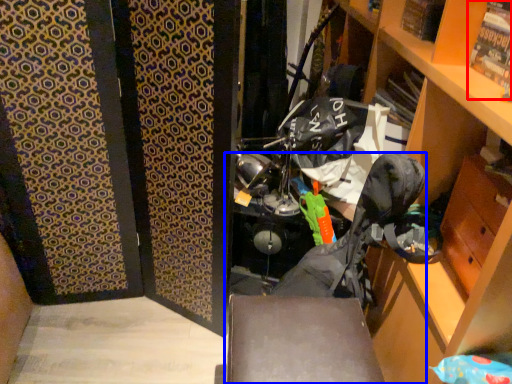
Question: Which of the following is the farthest to the observer, magazine (highlighted by a red box) or folding chair (highlighted by a blue box)?

Choices:
 (A) magazine
 (B) folding chair

Answer: (B)